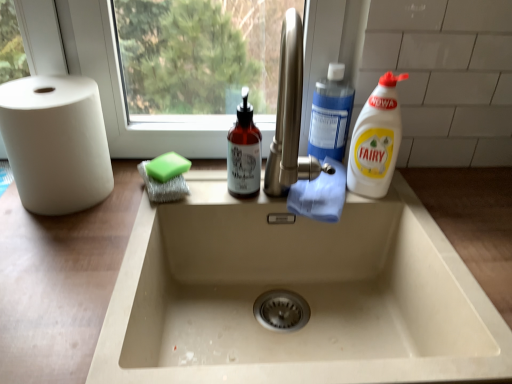
Identify the location of free space in front of white matte paper towel at left. (58, 243).